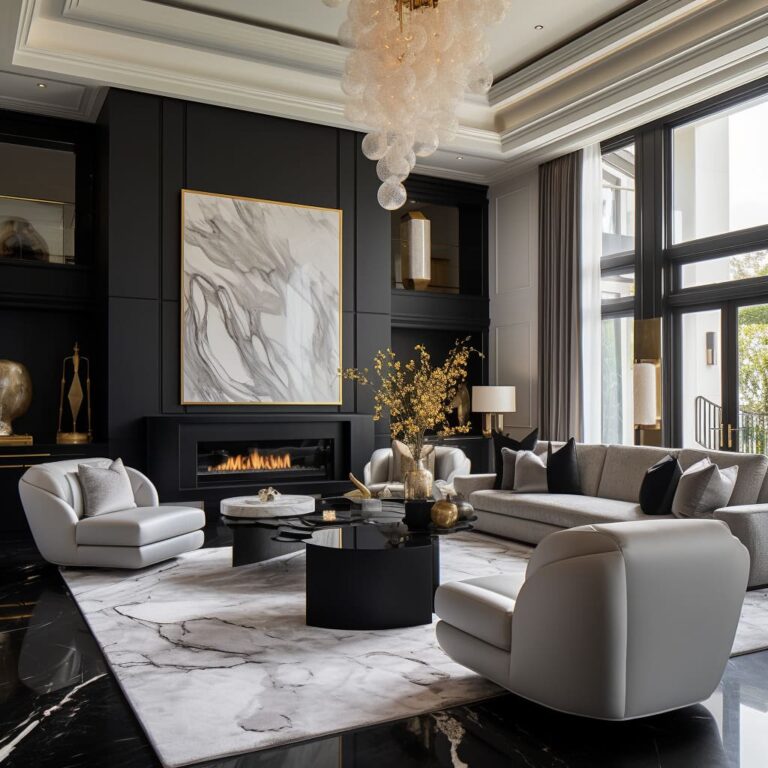
At what (x,y) coordinates should I click in order to perform the action: click on fire place. Please return your answer as a coordinate pair (x, y). Looking at the image, I should click on (326, 425).